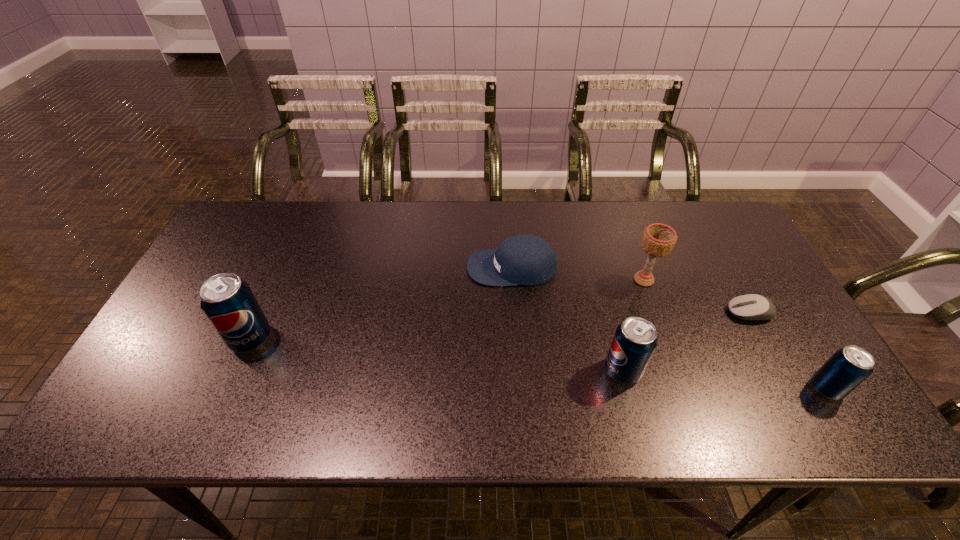
Identify the location of free spot between the leftmost soda can and the chalice. The height and width of the screenshot is (540, 960). (447, 309).

The height and width of the screenshot is (540, 960). In order to click on free space between the computer equipment and the fifth object from right to left in this screenshot , I will do `click(631, 290)`.

At what (x,y) coordinates should I click in order to perform the action: click on vacant region between the shortest object and the shortest soda can. Please return your answer as a coordinate pair (x, y). The image size is (960, 540). Looking at the image, I should click on (788, 350).

Where is `free point between the third shortest object and the leftmost soda can`? This screenshot has width=960, height=540. free point between the third shortest object and the leftmost soda can is located at coordinates (539, 363).

Image resolution: width=960 pixels, height=540 pixels. What are the coordinates of `unoccupied position between the rightmost soda can and the chalice` in the screenshot? It's located at (735, 334).

Select which object appears as the second closest to the leftmost object. Please provide its 2D coordinates. Your answer should be formatted as a tuple, i.e. [(x, y)], where the tuple contains the x and y coordinates of a point satisfying the conditions above.

[(635, 340)]

Identify the location of object that stands as the third closest to the second shortest soda can. The height and width of the screenshot is (540, 960). (754, 307).

Identify which soda can is the closest to the leftmost soda can. Please provide its 2D coordinates. Your answer should be formatted as a tuple, i.e. [(x, y)], where the tuple contains the x and y coordinates of a point satisfying the conditions above.

[(635, 340)]

Point out which soda can is positioned as the third nearest to the third object from right to left. Please provide its 2D coordinates. Your answer should be formatted as a tuple, i.e. [(x, y)], where the tuple contains the x and y coordinates of a point satisfying the conditions above.

[(227, 301)]

In order to click on free location that satisfies the following two spatial constraints: 1. on the front-facing side of the second object from left to right; 2. on the right side of the second shortest soda can in this screenshot , I will do `click(518, 370)`.